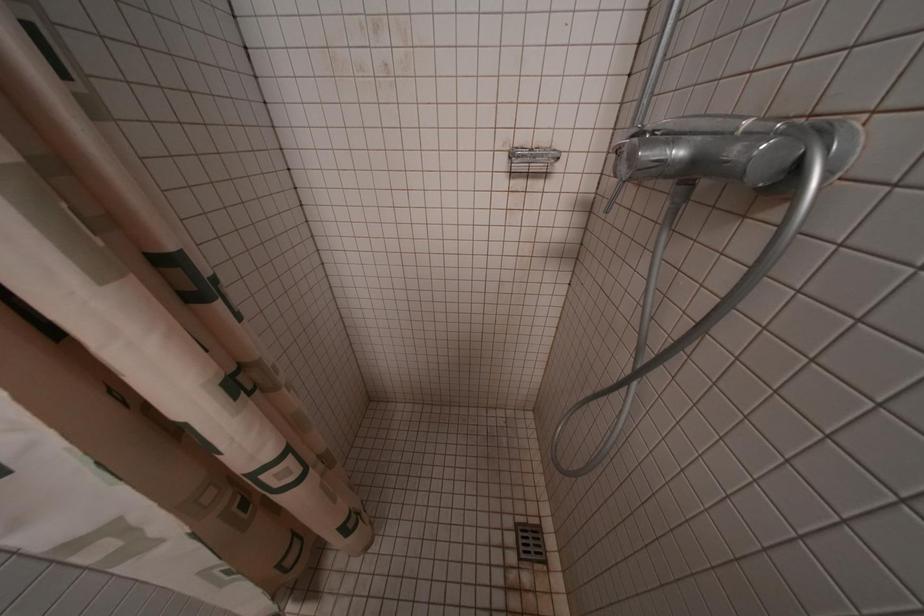
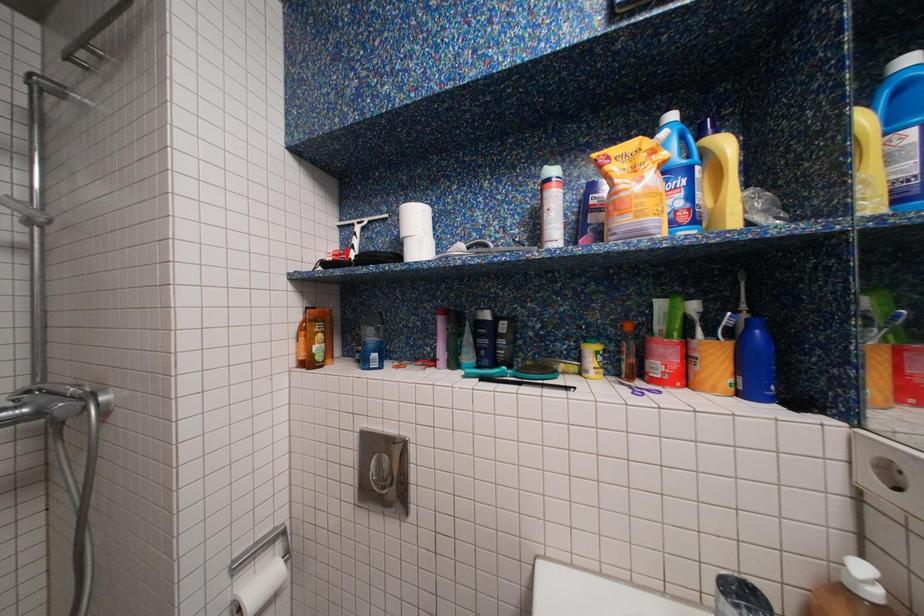
Question: The camera is either moving clockwise (left) or counter-clockwise (right) around the object. The first image is from the beginning of the video and the second image is from the end. Is the camera moving left or right when shooting the video?

Choices:
 (A) Left
 (B) Right

Answer: (A)